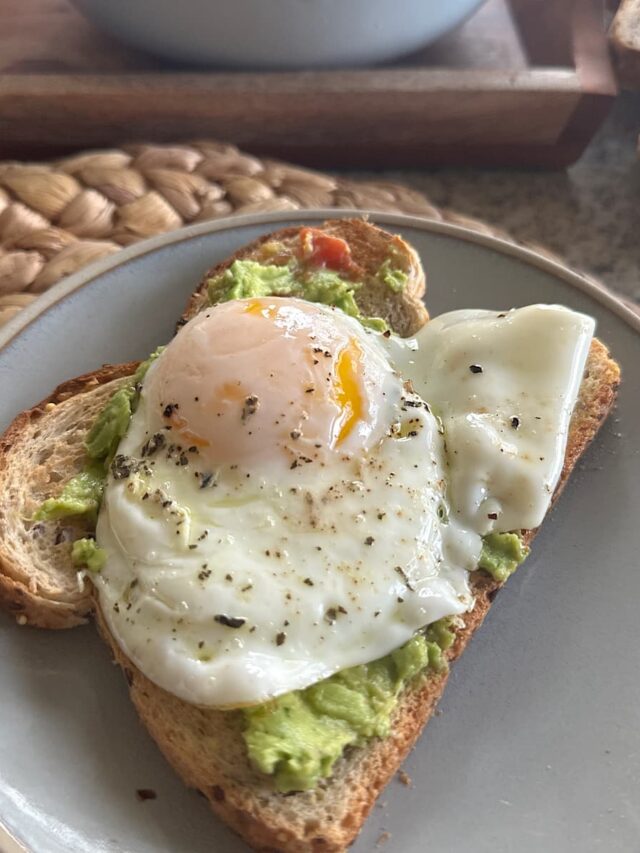
Identify the location of wicker. This screenshot has width=640, height=853. (61, 247).